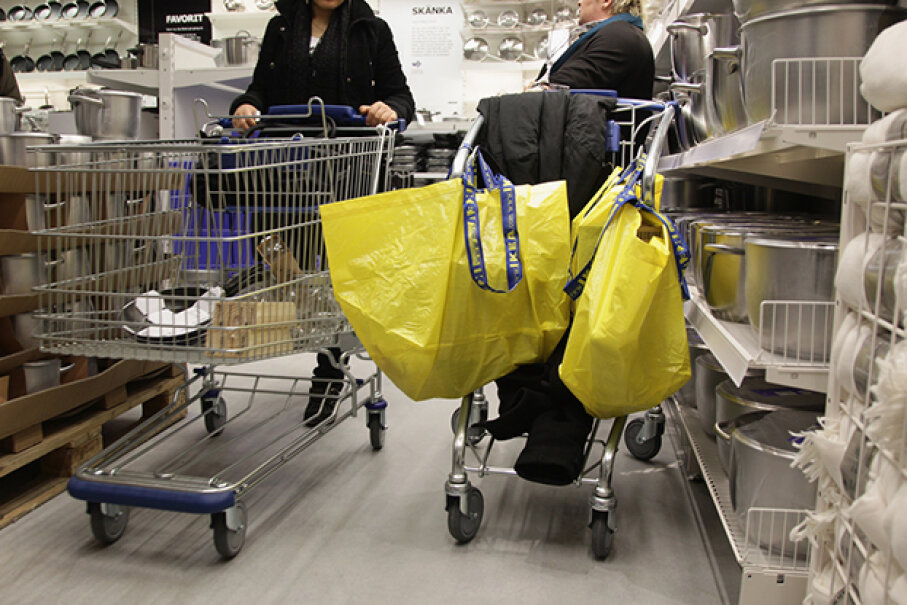
In order to click on floor in this screenshot , I will do `click(398, 546)`.